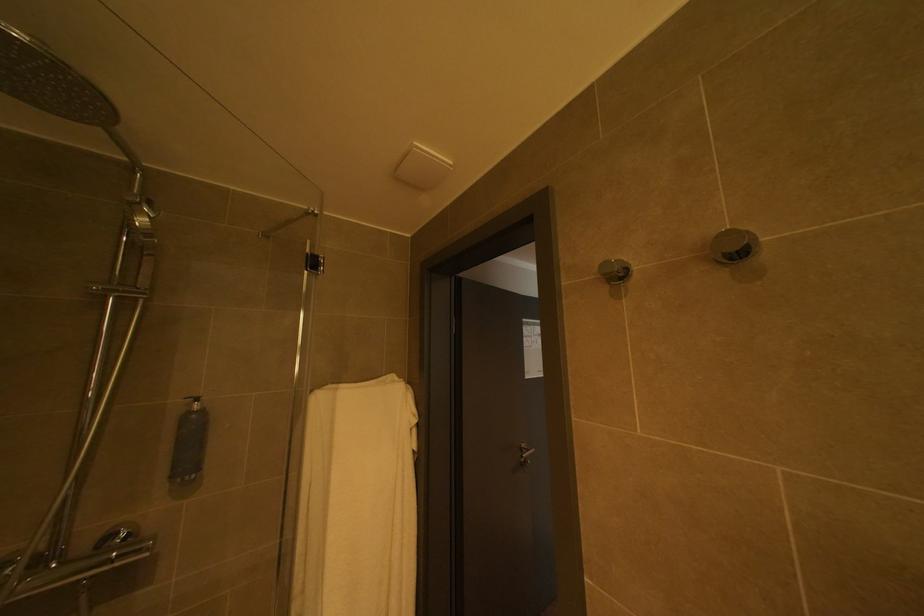
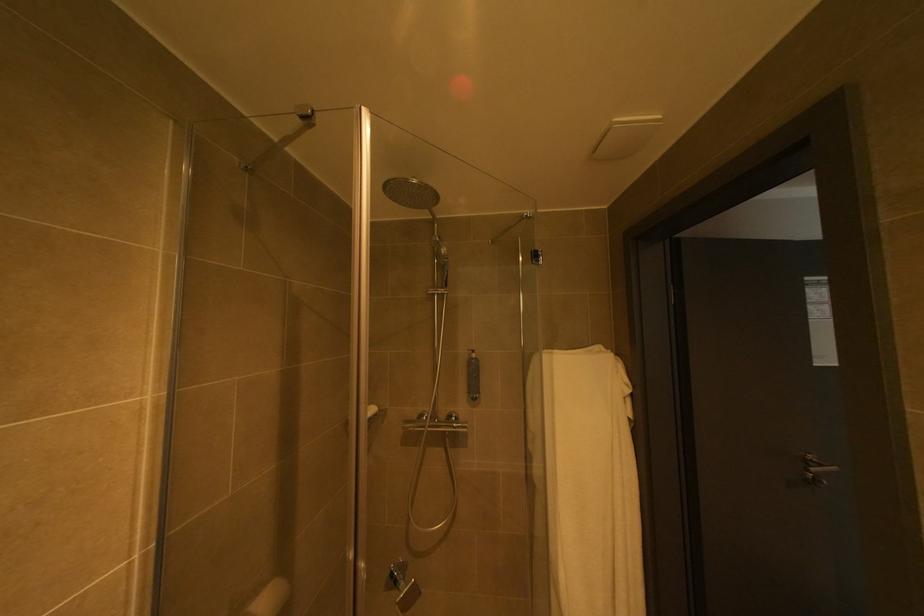
Question: The camera is either moving clockwise (left) or counter-clockwise (right) around the object. The first image is from the beginning of the video and the second image is from the end. Is the camera moving left or right when shooting the video?

Choices:
 (A) Left
 (B) Right

Answer: (B)